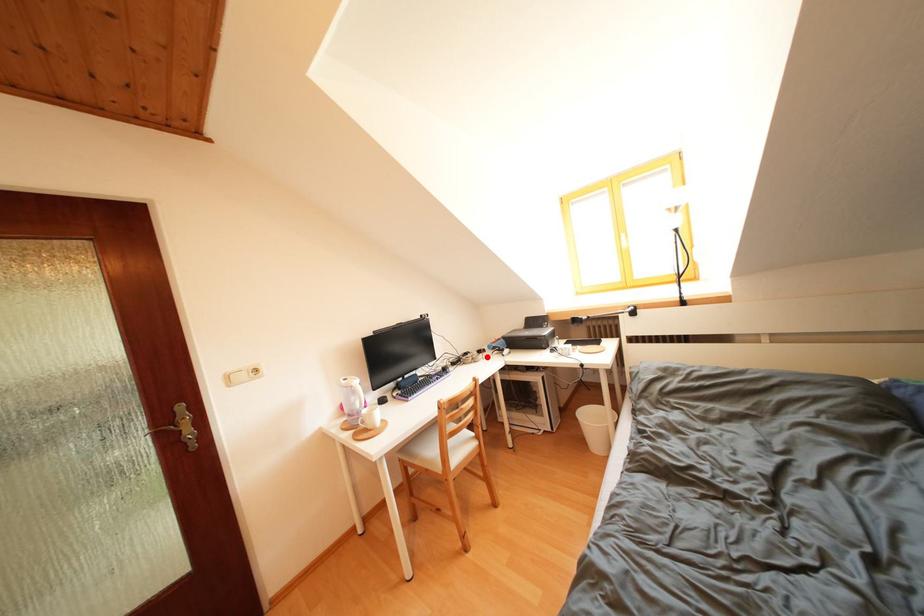
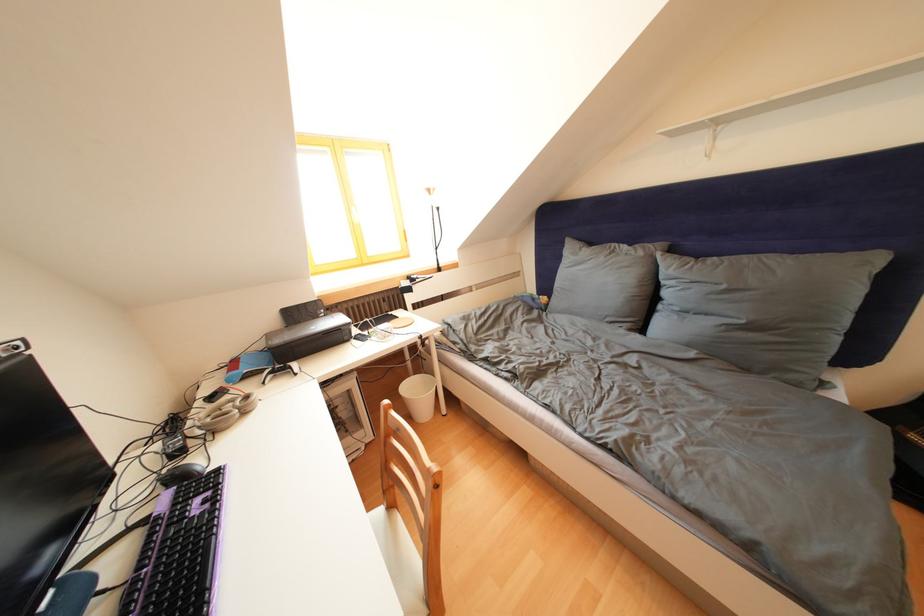
Where in the second image is the point corresponding to the highlighted location from the first image?

(220, 403)